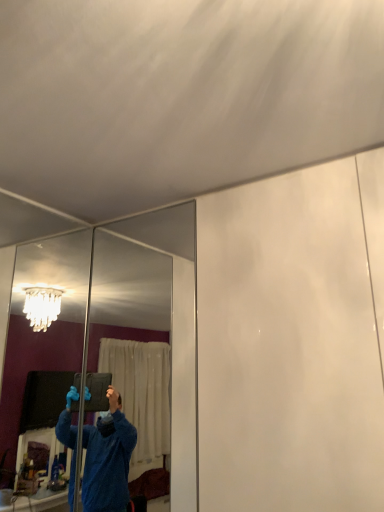
Question: Is clear glass mirror at left, the 1th mirror in the left-to-right sequence, bigger or smaller than clear glass mirror at center, arranged as the second mirror when viewed from the left?

Choices:
 (A) big
 (B) small

Answer: (B)

Question: Considering the positions of clear glass mirror at left, positioned as the 2th mirror in right-to-left order, and clear glass mirror at center, arranged as the second mirror when viewed from the left, in the image, is clear glass mirror at left, positioned as the 2th mirror in right-to-left order, wider or thinner than clear glass mirror at center, arranged as the second mirror when viewed from the left,?

Choices:
 (A) wide
 (B) thin

Answer: (B)

Question: From the image's perspective, is clear glass mirror at left, the 1th mirror in the left-to-right sequence, located above or below clear glass mirror at center, arranged as the second mirror when viewed from the left?

Choices:
 (A) below
 (B) above

Answer: (B)

Question: Is clear glass mirror at center, arranged as the second mirror when viewed from the left, taller or shorter than clear glass mirror at left, the 1th mirror in the left-to-right sequence?

Choices:
 (A) short
 (B) tall

Answer: (A)

Question: From the image's perspective, is clear glass mirror at center, arranged as the second mirror when viewed from the left, positioned above or below clear glass mirror at left, the 1th mirror in the left-to-right sequence?

Choices:
 (A) below
 (B) above

Answer: (A)

Question: Is point (195, 391) closer or farther from the camera than point (21, 296)?

Choices:
 (A) closer
 (B) farther

Answer: (A)

Question: In terms of width, does clear glass mirror at center, arranged as the second mirror when viewed from the left, look wider or thinner when compared to clear glass mirror at left, the 1th mirror in the left-to-right sequence?

Choices:
 (A) wide
 (B) thin

Answer: (A)